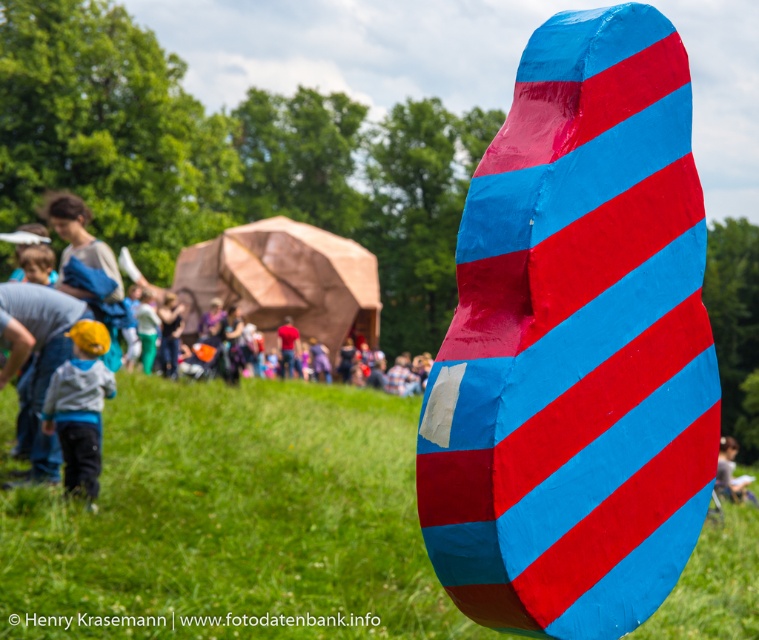
Between green grass at center and matte yellow cap at lower left, which one has more height?

green grass at center

Find the location of `green grass at center`. green grass at center is located at coordinates (232, 522).

This screenshot has height=640, width=759. In order to click on green grass at center in this screenshot , I will do coord(232,522).

Identify the location of green grass at center. (232, 522).

Who is more distant from viewer, (175, 317) or (739, 497)?

Point (175, 317)

Who is lower down, wooden dome at center or matte blue paper at center?

matte blue paper at center is below.

What are the coordinates of `wooden dome at center` in the screenshot? It's located at (222, 349).

This screenshot has height=640, width=759. I want to click on wooden dome at center, so click(x=222, y=349).

Who is positioned more to the right, shiny plastic rock at center or matte yellow cap at lower left?

shiny plastic rock at center is more to the right.

Does shiny plastic rock at center appear on the left side of matte yellow cap at lower left?

No, shiny plastic rock at center is not to the left of matte yellow cap at lower left.

Identify the location of shiny plastic rock at center. (575, 342).